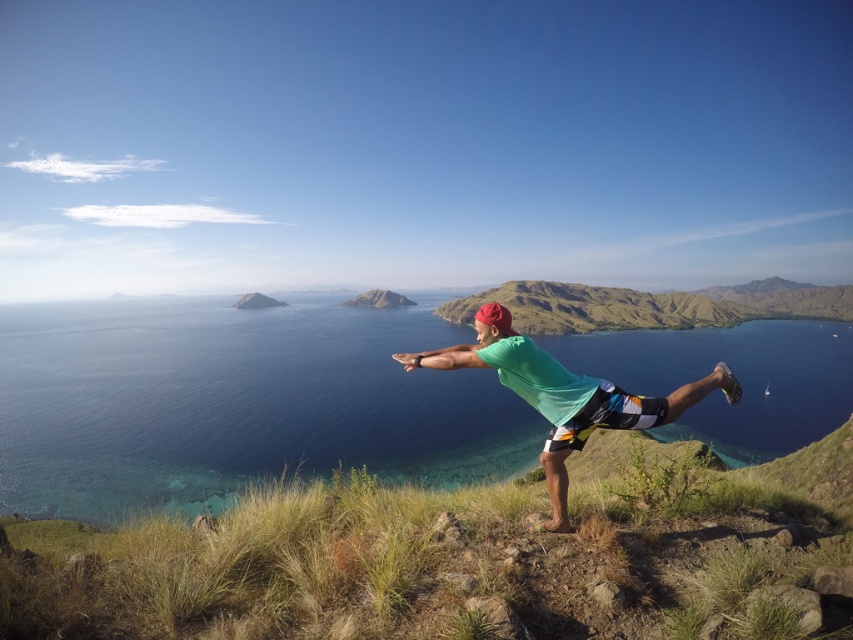
Question: Which object is closer to the camera taking this photo?

Choices:
 (A) green grassy hillside at center
 (B) clear blue water at center

Answer: (A)

Question: In this image, where is clear blue water at center located relative to multicolored woven shorts at center?

Choices:
 (A) right
 (B) left

Answer: (A)

Question: Estimate the real-world distances between objects in this image. Which object is closer to the green fabric shirt at center?

Choices:
 (A) multicolored woven shorts at center
 (B) green grassy hillside at center
 (C) clear blue water at center

Answer: (A)

Question: Observing the image, what is the correct spatial positioning of green grassy hillside at center in reference to clear blue water at center?

Choices:
 (A) above
 (B) below

Answer: (B)

Question: Estimate the real-world distances between objects in this image. Which object is farther from the clear blue water at center?

Choices:
 (A) green fabric shirt at center
 (B) green grassy hillside at center

Answer: (A)

Question: Is green grassy hillside at center in front of multicolored woven shorts at center?

Choices:
 (A) no
 (B) yes

Answer: (B)